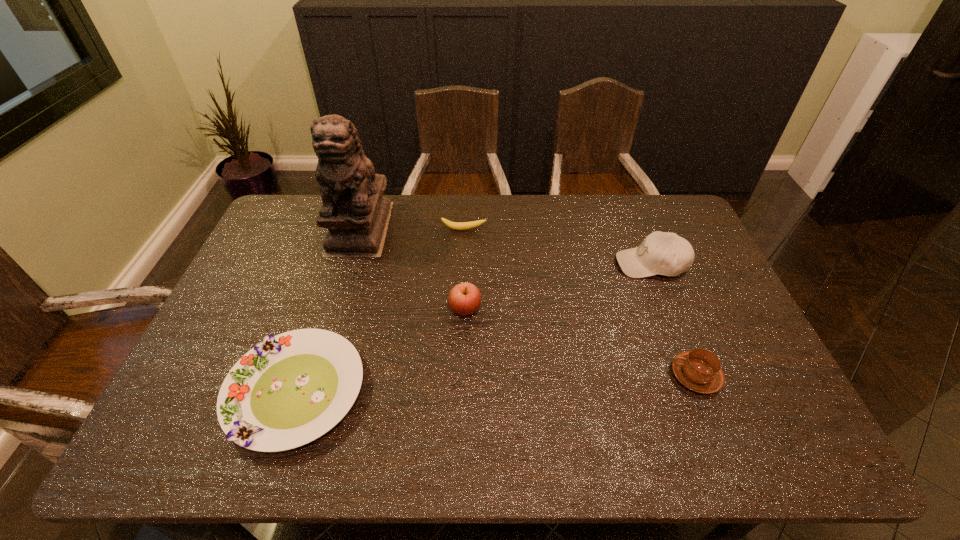
This screenshot has height=540, width=960. What are the coordinates of `object that ranks as the closest to the salad plate` in the screenshot? It's located at (464, 299).

The width and height of the screenshot is (960, 540). Find the location of `vacant region that satisfies the following two spatial constraints: 1. on the front-facing side of the fifth shortest object; 2. on the front side of the third nearest object`. vacant region that satisfies the following two spatial constraints: 1. on the front-facing side of the fifth shortest object; 2. on the front side of the third nearest object is located at coordinates (669, 309).

What are the coordinates of `vacant area that satisfies the following two spatial constraints: 1. on the front-facing side of the third nearest object; 2. on the right side of the tallest object` in the screenshot? It's located at (335, 309).

In order to click on free space that satisfies the following two spatial constraints: 1. on the front-facing side of the baseball cap; 2. on the front side of the third tallest object in this screenshot , I will do `click(669, 309)`.

Where is `vacant point that satisfies the following two spatial constraints: 1. on the front-facing side of the tallest object; 2. on the left side of the fourth shortest object`? The image size is (960, 540). vacant point that satisfies the following two spatial constraints: 1. on the front-facing side of the tallest object; 2. on the left side of the fourth shortest object is located at coordinates (335, 309).